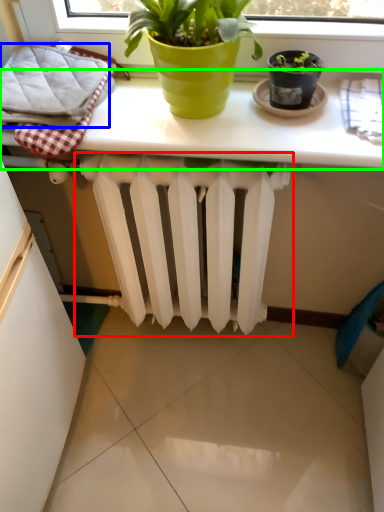
Question: Estimate the real-world distances between objects in this image. Which object is farther from radiator (highlighted by a red box), bath towel (highlighted by a blue box) or table (highlighted by a green box)?

Choices:
 (A) bath towel
 (B) table

Answer: (A)